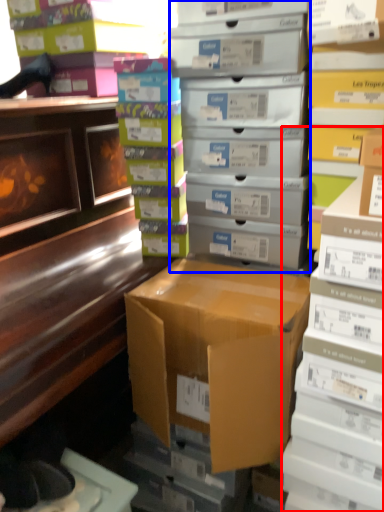
Question: Which object appears closest to the camera in this image, book (highlighted by a red box) or shelf (highlighted by a blue box)?

Choices:
 (A) book
 (B) shelf

Answer: (A)